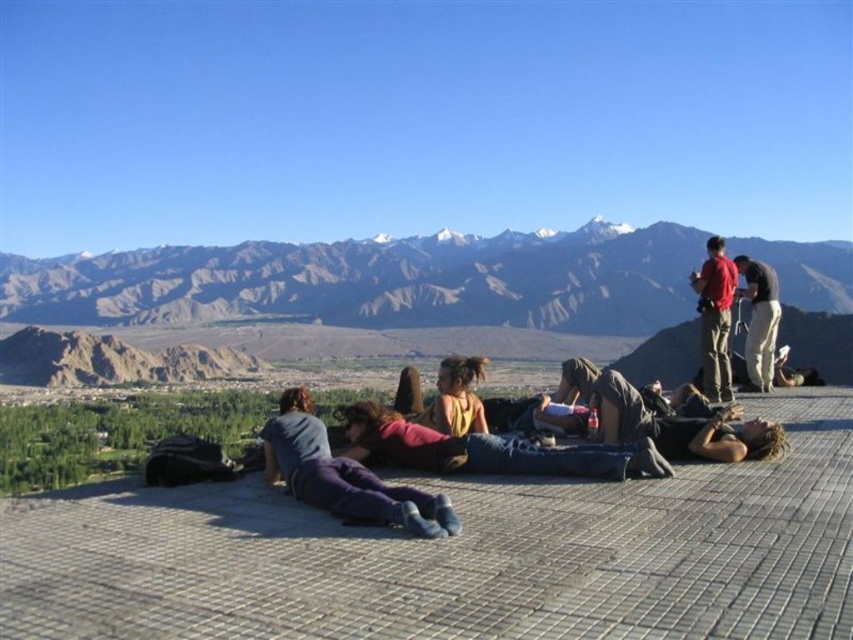
Which is below, rugged brown mountains at upper center or denim jeans at center?

Positioned lower is denim jeans at center.

How much distance is there between rugged brown mountains at upper center and denim jeans at center?

rugged brown mountains at upper center is 506.62 meters away from denim jeans at center.

Who is more forward, (x=111, y=308) or (x=425, y=433)?

Positioned in front is point (x=425, y=433).

This screenshot has height=640, width=853. Find the location of `rugged brown mountains at upper center`. rugged brown mountains at upper center is located at coordinates (376, 282).

Does rugged brown mountains at upper center appear over purple cotton pants at center?

Indeed, rugged brown mountains at upper center is positioned over purple cotton pants at center.

This screenshot has width=853, height=640. I want to click on rugged brown mountains at upper center, so click(x=376, y=282).

What are the coordinates of `rugged brown mountains at upper center` in the screenshot? It's located at (376, 282).

Who is higher up, dark brown hair at center or matte red shirt at upper right?

matte red shirt at upper right is above.

How distant is dark brown hair at center from matte red shirt at upper right?

dark brown hair at center and matte red shirt at upper right are 54.21 feet apart.

This screenshot has height=640, width=853. What are the coordinates of `dark brown hair at center` in the screenshot? It's located at (666, 419).

You are a GUI agent. You are given a task and a screenshot of the screen. Output one action in this format:
    pyautogui.click(x=<x>, y=<y>)
    Task: Click on the dark brown hair at center
    Image resolution: width=853 pixels, height=640 pixels.
    Given the screenshot: What is the action you would take?
    pyautogui.click(x=666, y=419)